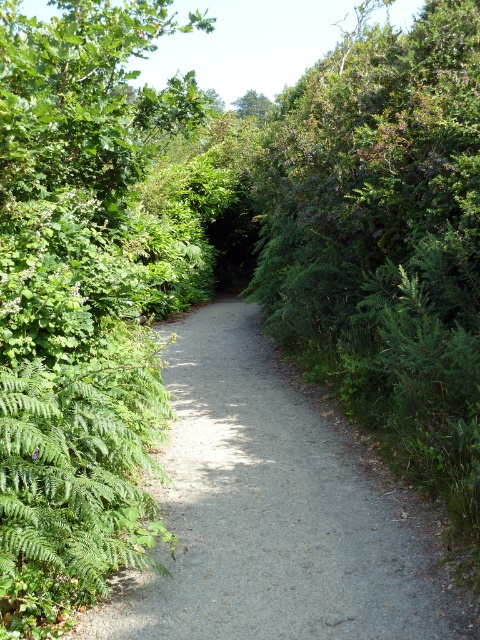
Who is positioned more to the right, gray gravel path at center or green leafy tree at upper center?

Positioned to the right is green leafy tree at upper center.

Is point (328, 612) farther from viewer compared to point (261, 120)?

No.

Between point (99, 618) and point (256, 116), which one is positioned behind?

The point (256, 116) is more distant.

Find the location of a particular element. gray gravel path at center is located at coordinates (275, 512).